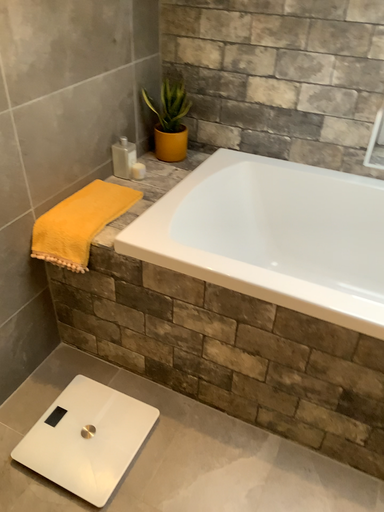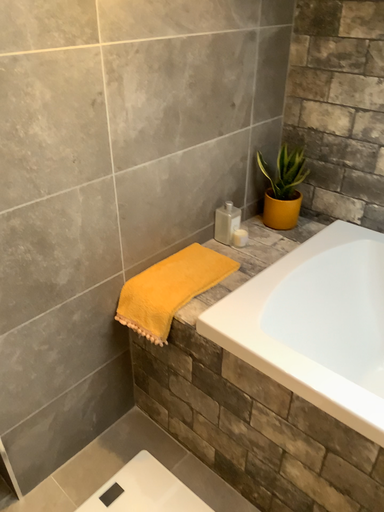
Question: Which way did the camera rotate in the video?

Choices:
 (A) rotated upward
 (B) rotated downward

Answer: (A)